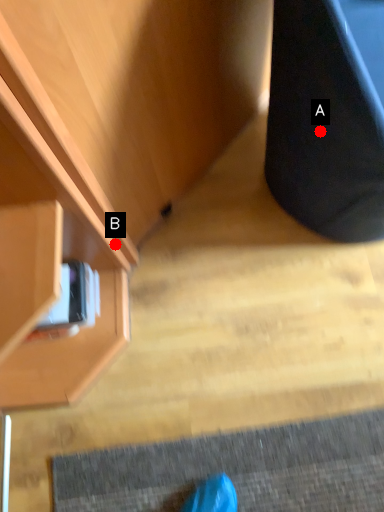
Question: Two points are circled on the image, labeled by A and B beside each circle. Which of the following is the farthest from the observer?

Choices:
 (A) A is further
 (B) B is further

Answer: (B)